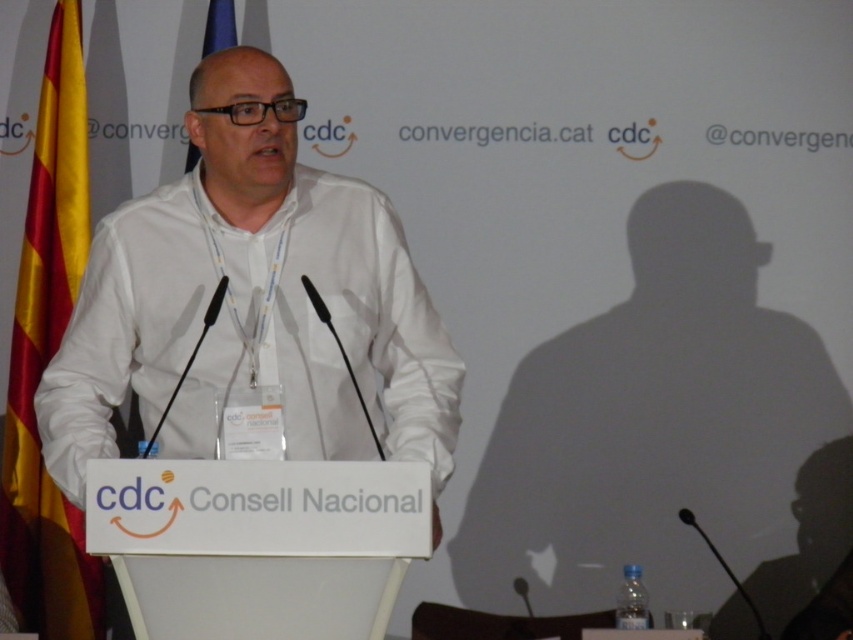
You are an attendee at the conference and want to take a photo of the speaker. The camera you have can only focus on objects within 10 feet. Is the white matte shirt at center within the focus range of your camera?

The white matte shirt at center is 9.51 feet from the viewer, which is within the camera focus range of 10 feet. Therefore, the camera can focus on the white matte shirt at center.